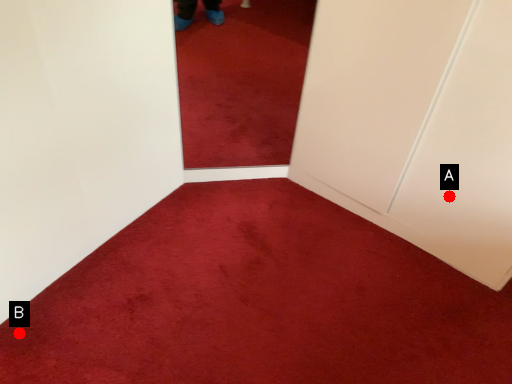
Question: Two points are circled on the image, labeled by A and B beside each circle. Which point is closer to the camera?

Choices:
 (A) A is closer
 (B) B is closer

Answer: (B)